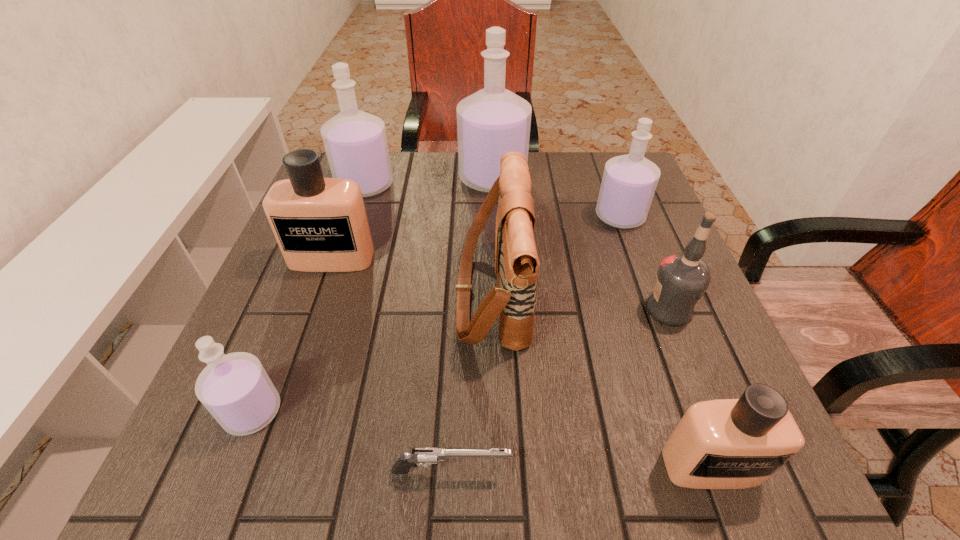
Find the location of a particular element. Image resolution: width=960 pixels, height=540 pixels. vacant area that lies between the third nearest perfume and the nearest purple perfume is located at coordinates (292, 335).

The width and height of the screenshot is (960, 540). In order to click on unoccupied position between the vodka and the shoulder bag in this screenshot , I will do `click(581, 301)`.

At what (x,y) coordinates should I click in order to perform the action: click on vacant area that lies between the shortest object and the rightmost purple perfume. Please return your answer as a coordinate pair (x, y). Looking at the image, I should click on (536, 344).

Image resolution: width=960 pixels, height=540 pixels. Find the location of `free space between the fourth farthest perfume and the pistol`. free space between the fourth farthest perfume and the pistol is located at coordinates (392, 364).

Find the location of `free spot between the fourth perfume from left to right and the farther beige perfume`. free spot between the fourth perfume from left to right and the farther beige perfume is located at coordinates (412, 219).

Identify the location of free area in between the shortest object and the third nearest perfume. (392, 364).

Find the location of `free space that is in between the seventh farthest object and the shoulder bag`. free space that is in between the seventh farthest object and the shoulder bag is located at coordinates (372, 352).

This screenshot has width=960, height=540. I want to click on object that can be found as the fifth closest to the shoulder bag, so click(x=739, y=443).

At what (x,y) coordinates should I click in order to perform the action: click on object that is the sixth nearest to the tallest perfume. Please return your answer as a coordinate pair (x, y). This screenshot has width=960, height=540. Looking at the image, I should click on (235, 388).

Identify which perfume is located as the fourth nearest to the second smallest purple perfume. Please provide its 2D coordinates. Your answer should be formatted as a tuple, i.e. [(x, y)], where the tuple contains the x and y coordinates of a point satisfying the conditions above.

[(320, 224)]